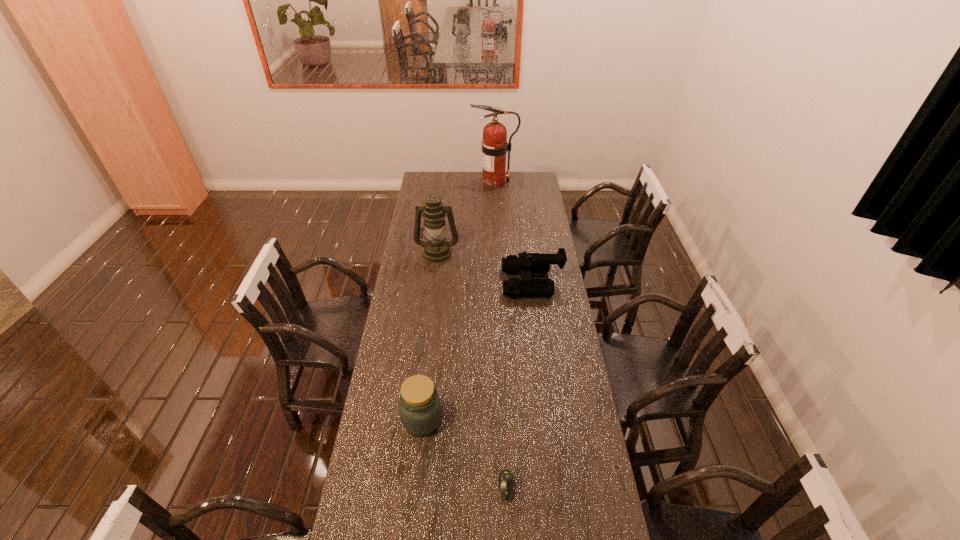
The width and height of the screenshot is (960, 540). Identify the location of vacant area located 0.080m at the nozzle of the fire extinguisher. (459, 182).

Identify the location of free spot located on the right of the fourth nearest object. (528, 252).

Where is `free location located 0.110m on the front of the jar`? The width and height of the screenshot is (960, 540). free location located 0.110m on the front of the jar is located at coordinates (417, 472).

The width and height of the screenshot is (960, 540). Find the location of `blank space located 0.090m on the front lenses of the binoculars`. blank space located 0.090m on the front lenses of the binoculars is located at coordinates 483,282.

Identify the location of free spot located on the front lenses of the binoculars. (463, 282).

I want to click on vacant region located on the front lenses of the binoculars, so click(x=461, y=282).

Identify the location of blank space located 0.100m on the wheel side of the computer mouse. This screenshot has height=540, width=960. (509, 539).

Image resolution: width=960 pixels, height=540 pixels. Find the location of `object that is at the far edge`. object that is at the far edge is located at coordinates (494, 145).

The image size is (960, 540). I want to click on oil lamp that is positioned at the left edge, so click(436, 249).

Locate an element on the screen. The image size is (960, 540). jar at the left edge is located at coordinates (420, 408).